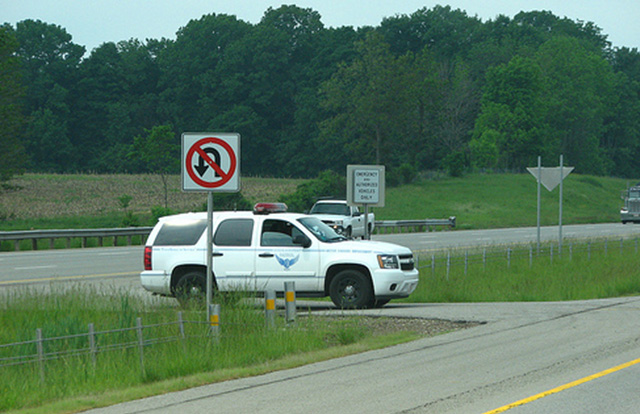
Locate an element on the screen. This screenshot has width=640, height=414. open window is located at coordinates (281, 235).